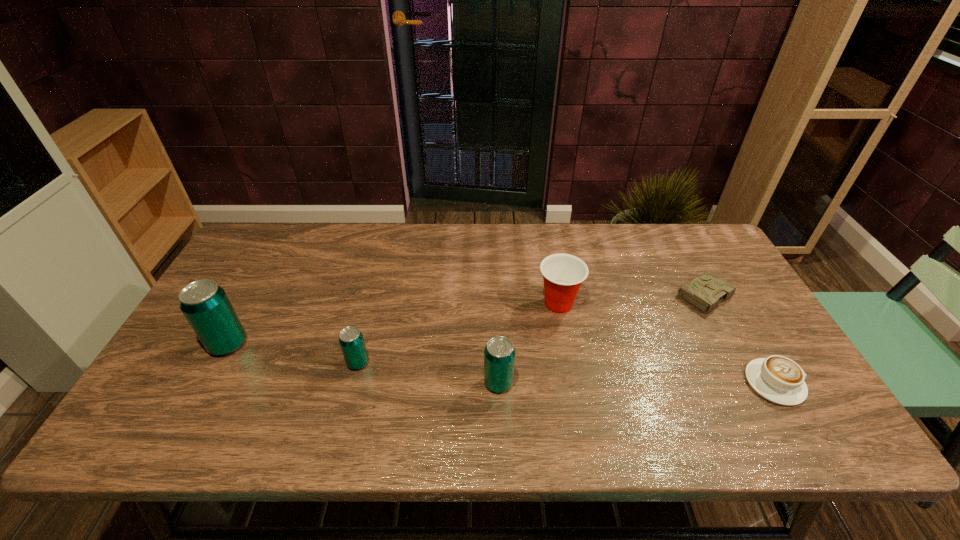
Locate an element on the screen. The image size is (960, 540). free space located on the back of the second object from left to right is located at coordinates (376, 289).

Where is `blank area located 0.330m on the left of the fourth object from right to left`? This screenshot has width=960, height=540. blank area located 0.330m on the left of the fourth object from right to left is located at coordinates (348, 383).

At what (x,y) coordinates should I click in order to perform the action: click on vacant space positioned on the left of the shortest object. Please return your answer as a coordinate pair (x, y). The image size is (960, 540). Looking at the image, I should click on (591, 296).

Where is `vacant space situated on the left of the cup`? The image size is (960, 540). vacant space situated on the left of the cup is located at coordinates (396, 303).

Identify the location of beer can located in the near edge section of the desktop. This screenshot has width=960, height=540. (499, 354).

You are a GUI agent. You are given a task and a screenshot of the screen. Output one action in this format:
    pyautogui.click(x=<x>, y=<y>)
    Task: Click on the cappuccino that is positioned at the near edge
    Image resolution: width=960 pixels, height=540 pixels.
    Given the screenshot: What is the action you would take?
    pyautogui.click(x=778, y=379)

You are a GUI agent. You are given a task and a screenshot of the screen. Output one action in this format:
    pyautogui.click(x=<x>, y=<y>)
    Task: Click on the object that is at the left edge
    This screenshot has width=960, height=540.
    Given the screenshot: What is the action you would take?
    pyautogui.click(x=206, y=306)

At what (x,y) coordinates should I click in order to perform the action: click on diary that is at the right edge. Please return your answer as a coordinate pair (x, y). This screenshot has height=540, width=960. Looking at the image, I should click on (705, 291).

Image resolution: width=960 pixels, height=540 pixels. What are the coordinates of `cappuccino that is at the right edge` in the screenshot? It's located at (778, 379).

Find the location of a particular element. The image size is (960, 540). object present at the near right corner is located at coordinates (778, 379).